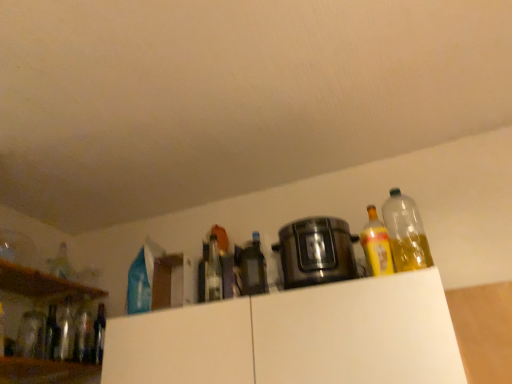
Question: From the image's perspective, is translucent glass bottle at left, the ninth bottle when ordered from right to left, under translucent glass bottle at left, marked as the 7th bottle in a right-to-left arrangement?

Choices:
 (A) no
 (B) yes

Answer: (A)

Question: Is the depth of translucent glass bottle at left, the ninth bottle when ordered from right to left, greater than that of translucent glass bottle at left, the third bottle viewed from the left?

Choices:
 (A) yes
 (B) no

Answer: (B)

Question: Is translucent glass bottle at left, marked as the 7th bottle in a right-to-left arrangement, at the back of translucent glass bottle at left, which is counted as the first bottle, starting from the left?

Choices:
 (A) yes
 (B) no

Answer: (B)

Question: Is translucent glass bottle at left, which is counted as the first bottle, starting from the left, located outside translucent glass bottle at left, the third bottle viewed from the left?

Choices:
 (A) no
 (B) yes

Answer: (B)

Question: Is translucent glass bottle at left, the ninth bottle when ordered from right to left, not close to translucent glass bottle at left, marked as the 7th bottle in a right-to-left arrangement?

Choices:
 (A) yes
 (B) no

Answer: (B)

Question: In terms of width, does yellow translucent bottle at right, the 8th bottle viewed from the left, look wider or thinner when compared to matte glass bottle at center, the seventh bottle when ordered from left to right?

Choices:
 (A) thin
 (B) wide

Answer: (B)

Question: From a real-world perspective, is yellow translucent bottle at right, the 8th bottle viewed from the left, positioned above or below matte glass bottle at center, the seventh bottle when ordered from left to right?

Choices:
 (A) below
 (B) above

Answer: (A)

Question: Visually, is yellow translucent bottle at right, acting as the second bottle starting from the right, positioned to the left or to the right of matte glass bottle at center, the seventh bottle when ordered from left to right?

Choices:
 (A) right
 (B) left

Answer: (A)

Question: Considering the positions of yellow translucent bottle at right, the 8th bottle viewed from the left, and matte glass bottle at center, the 3th bottle in the right-to-left sequence, in the image, is yellow translucent bottle at right, the 8th bottle viewed from the left, taller or shorter than matte glass bottle at center, the 3th bottle in the right-to-left sequence,?

Choices:
 (A) short
 (B) tall

Answer: (A)

Question: Is translucent glass bottle at center, placed as the fourth bottle when sorted from left to right, to the left or to the right of translucent glass bottle at left, the third bottle viewed from the left, in the image?

Choices:
 (A) left
 (B) right

Answer: (B)

Question: Is translucent glass bottle at center, placed as the fourth bottle when sorted from left to right, inside the boundaries of translucent glass bottle at left, marked as the 7th bottle in a right-to-left arrangement, or outside?

Choices:
 (A) inside
 (B) outside

Answer: (B)

Question: Is point coord(82,337) closer or farther from the camera than point coord(70,347)?

Choices:
 (A) farther
 (B) closer

Answer: (A)

Question: In terms of height, does translucent glass bottle at center, placed as the fourth bottle when sorted from left to right, look taller or shorter compared to translucent glass bottle at left, the third bottle viewed from the left?

Choices:
 (A) tall
 (B) short

Answer: (B)

Question: From a real-world perspective, relative to white matte cabinet at upper center, arranged as the first cabinetry when viewed from the left, is translucent glass bottle at left, which is counted as the first bottle, starting from the left, vertically above or below?

Choices:
 (A) above
 (B) below

Answer: (B)

Question: Would you say translucent glass bottle at left, which is counted as the first bottle, starting from the left, is inside or outside white matte cabinet at upper center, arranged as the first cabinetry when viewed from the left?

Choices:
 (A) outside
 (B) inside

Answer: (A)